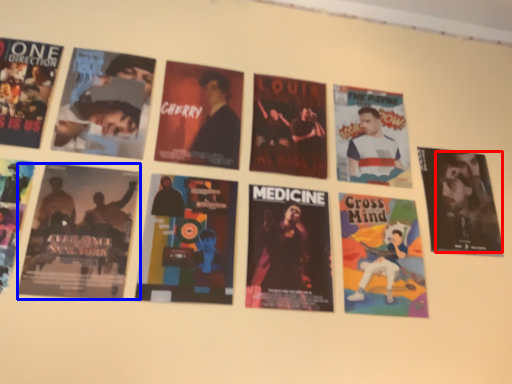
Question: Which of the following is the farthest to the observer, person (highlighted by a red box) or poster (highlighted by a blue box)?

Choices:
 (A) person
 (B) poster

Answer: (A)